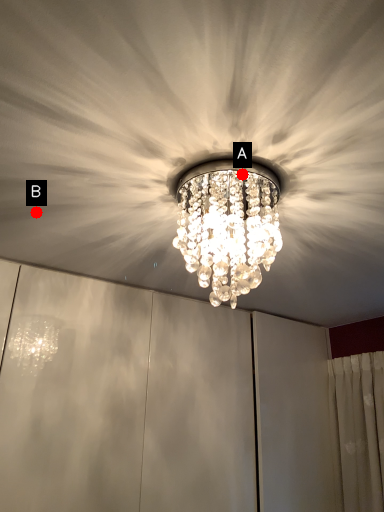
Question: Two points are circled on the image, labeled by A and B beside each circle. Which point is closer to the camera taking this photo?

Choices:
 (A) A is closer
 (B) B is closer

Answer: (A)